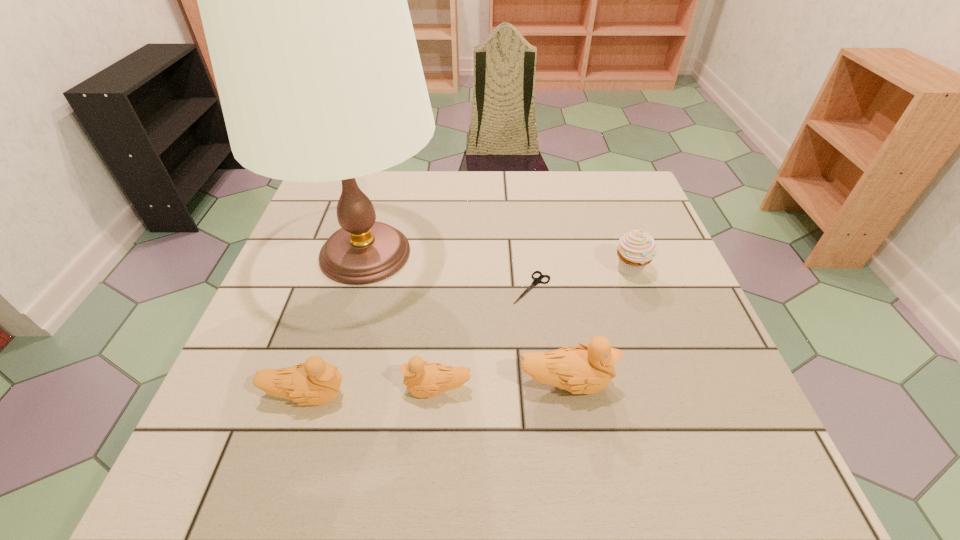
Locate an element on the screen. the leftmost duckling is located at coordinates (314, 382).

Where is `the fifth tallest object`? This screenshot has height=540, width=960. the fifth tallest object is located at coordinates (422, 379).

Locate an element on the screen. The image size is (960, 540). the shortest duckling is located at coordinates (422, 379).

Where is `the rightmost duckling`? The width and height of the screenshot is (960, 540). the rightmost duckling is located at coordinates (588, 369).

At what (x,y) coordinates should I click in order to perform the action: click on the tallest object. Please return your answer as a coordinate pair (x, y). This screenshot has height=540, width=960. Looking at the image, I should click on (303, 0).

This screenshot has height=540, width=960. What are the coordinates of `the shortest object` in the screenshot? It's located at (537, 280).

Find the location of a particular element. This screenshot has height=540, width=960. muffin is located at coordinates (637, 248).

Locate an element on the screen. This screenshot has height=540, width=960. free space located on the face of the second tallest duckling is located at coordinates (414, 396).

Locate an element on the screen. free space located 0.310m on the face of the fifth tallest object is located at coordinates (237, 389).

The height and width of the screenshot is (540, 960). Identify the location of free space located on the face of the fifth tallest object. (372, 389).